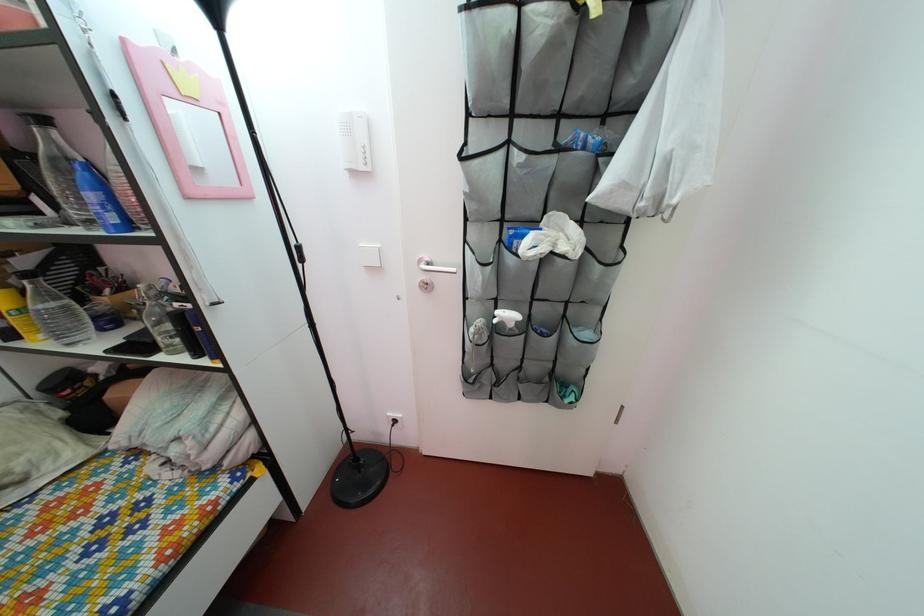
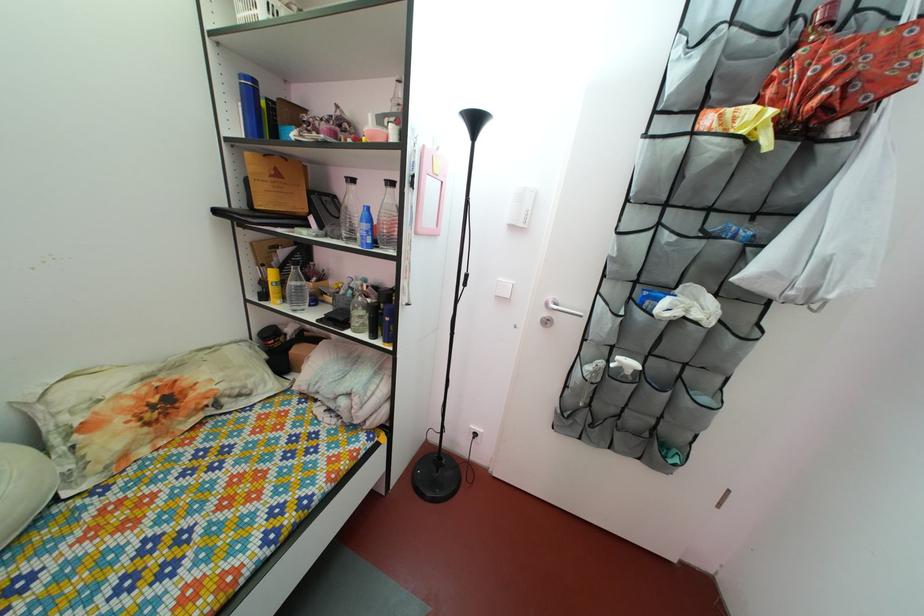
Find the pixel in the second image that matches (x=32, y=270) in the first image.

(292, 262)